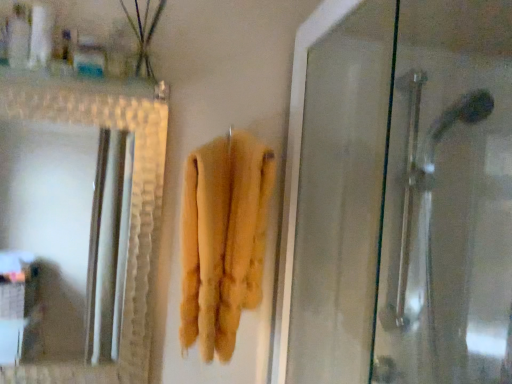
Question: Can you confirm if translucent plastic container at upper left, the first toiletry viewed from the right, is wider than white plastic container at upper left, which is counted as the 2th toiletry, starting from the right?

Choices:
 (A) yes
 (B) no

Answer: (A)

Question: Can you confirm if translucent plastic container at upper left, the first toiletry viewed from the right, is shorter than white plastic container at upper left, the 1th toiletry when ordered from left to right?

Choices:
 (A) no
 (B) yes

Answer: (B)

Question: Could you tell me if translucent plastic container at upper left, the first toiletry viewed from the right, is facing white plastic container at upper left, which is counted as the 2th toiletry, starting from the right?

Choices:
 (A) no
 (B) yes

Answer: (A)

Question: From a real-world perspective, is translucent plastic container at upper left, arranged as the second toiletry when viewed from the left, physically below white plastic container at upper left, which is counted as the 2th toiletry, starting from the right?

Choices:
 (A) yes
 (B) no

Answer: (A)

Question: Is translucent plastic container at upper left, the first toiletry viewed from the right, far from white plastic container at upper left, which is counted as the 2th toiletry, starting from the right?

Choices:
 (A) no
 (B) yes

Answer: (A)

Question: In the image, is yellow fluffy towel at center positioned in front of or behind green matte plant at upper left?

Choices:
 (A) front
 (B) behind

Answer: (A)

Question: From the image's perspective, is yellow fluffy towel at center positioned above or below green matte plant at upper left?

Choices:
 (A) above
 (B) below

Answer: (B)

Question: Is yellow fluffy towel at center bigger or smaller than green matte plant at upper left?

Choices:
 (A) small
 (B) big

Answer: (B)

Question: In terms of height, does yellow fluffy towel at center look taller or shorter compared to green matte plant at upper left?

Choices:
 (A) tall
 (B) short

Answer: (A)

Question: Does point (15, 4) appear closer or farther from the camera than point (258, 203)?

Choices:
 (A) closer
 (B) farther

Answer: (B)

Question: Do you think white plastic container at upper left, the 1th toiletry when ordered from left to right, is within yellow fluffy towel at center, or outside of it?

Choices:
 (A) inside
 (B) outside

Answer: (B)

Question: From a real-world perspective, relative to yellow fluffy towel at center, is white plastic container at upper left, the 1th toiletry when ordered from left to right, vertically above or below?

Choices:
 (A) above
 (B) below

Answer: (A)

Question: Based on their sizes in the image, would you say white plastic container at upper left, the 1th toiletry when ordered from left to right, is bigger or smaller than yellow fluffy towel at center?

Choices:
 (A) big
 (B) small

Answer: (B)

Question: Considering the positions of green matte plant at upper left and translucent plastic container at upper left, the first toiletry viewed from the right, in the image, is green matte plant at upper left bigger or smaller than translucent plastic container at upper left, the first toiletry viewed from the right,?

Choices:
 (A) small
 (B) big

Answer: (B)

Question: Would you say green matte plant at upper left is inside or outside translucent plastic container at upper left, arranged as the second toiletry when viewed from the left?

Choices:
 (A) inside
 (B) outside

Answer: (B)